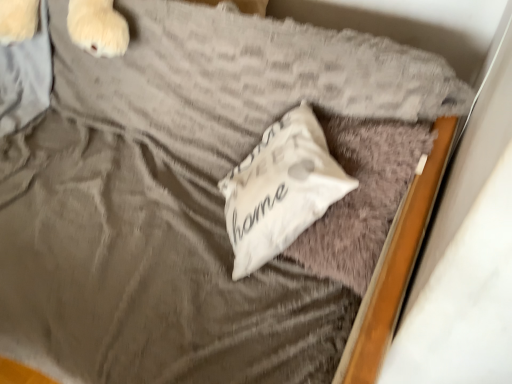
This screenshot has height=384, width=512. What do you see at coordinates (280, 189) in the screenshot? I see `white soft pillow at center, arranged as the 2th pillow when viewed from the right` at bounding box center [280, 189].

At what (x,y) coordinates should I click in order to perform the action: click on white soft pillow at center, arranged as the 2th pillow when viewed from the right. Please return your answer as a coordinate pair (x, y). Looking at the image, I should click on (280, 189).

In order to click on white soft pillow at center, placed as the 1th pillow when sorted from right to left in this screenshot , I will do `click(361, 195)`.

This screenshot has width=512, height=384. Describe the element at coordinates (361, 195) in the screenshot. I see `white soft pillow at center, placed as the 1th pillow when sorted from right to left` at that location.

Locate an element on the screen. This screenshot has width=512, height=384. white soft pillow at center, arranged as the 1th pillow when viewed from the left is located at coordinates (280, 189).

Does white soft pillow at center, arranged as the 1th pillow when viewed from the left, appear on the left side of white soft pillow at center, placed as the 1th pillow when sorted from right to left?

Indeed, white soft pillow at center, arranged as the 1th pillow when viewed from the left, is positioned on the left side of white soft pillow at center, placed as the 1th pillow when sorted from right to left.

Is white soft pillow at center, arranged as the 1th pillow when viewed from the left, further to camera compared to white soft pillow at center, placed as the 1th pillow when sorted from right to left?

Yes, white soft pillow at center, arranged as the 1th pillow when viewed from the left, is behind white soft pillow at center, placed as the 1th pillow when sorted from right to left.

Is point (341, 180) positioned after point (386, 235)?

Yes, it is behind point (386, 235).

From the image's perspective, relative to white soft pillow at center, placed as the 1th pillow when sorted from right to left, is white soft pillow at center, arranged as the 2th pillow when viewed from the right, above or below?

Clearly, from the image's perspective, white soft pillow at center, arranged as the 2th pillow when viewed from the right, is above white soft pillow at center, placed as the 1th pillow when sorted from right to left.

From the picture: From a real-world perspective, does white soft pillow at center, arranged as the 2th pillow when viewed from the right, stand above white soft pillow at center, which is counted as the second pillow, starting from the left?

Indeed, from a real-world perspective, white soft pillow at center, arranged as the 2th pillow when viewed from the right, stands above white soft pillow at center, which is counted as the second pillow, starting from the left.

Does white soft pillow at center, arranged as the 1th pillow when viewed from the left, have a greater width compared to white soft pillow at center, which is counted as the second pillow, starting from the left?

Incorrect, the width of white soft pillow at center, arranged as the 1th pillow when viewed from the left, does not surpass that of white soft pillow at center, which is counted as the second pillow, starting from the left.

Is white soft pillow at center, arranged as the 2th pillow when viewed from the right, shorter than white soft pillow at center, placed as the 1th pillow when sorted from right to left?

Correct, white soft pillow at center, arranged as the 2th pillow when viewed from the right, is not as tall as white soft pillow at center, placed as the 1th pillow when sorted from right to left.

Does white soft pillow at center, arranged as the 1th pillow when viewed from the left, have a larger size compared to white soft pillow at center, placed as the 1th pillow when sorted from right to left?

No, white soft pillow at center, arranged as the 1th pillow when viewed from the left, is not bigger than white soft pillow at center, placed as the 1th pillow when sorted from right to left.

Is white soft pillow at center, placed as the 1th pillow when sorted from right to left, a part of white soft pillow at center, arranged as the 1th pillow when viewed from the left?

Yes, white soft pillow at center, placed as the 1th pillow when sorted from right to left, is a part of white soft pillow at center, arranged as the 1th pillow when viewed from the left.

Is white soft pillow at center, arranged as the 2th pillow when viewed from the right, not near white soft pillow at center, placed as the 1th pillow when sorted from right to left?

white soft pillow at center, arranged as the 2th pillow when viewed from the right, is actually quite close to white soft pillow at center, placed as the 1th pillow when sorted from right to left.

Is white soft pillow at center, arranged as the 1th pillow when viewed from the left, turned away from white soft pillow at center, placed as the 1th pillow when sorted from right to left?

Yes, white soft pillow at center, placed as the 1th pillow when sorted from right to left, is at the back of white soft pillow at center, arranged as the 1th pillow when viewed from the left.

What are the coordinates of `pillow that is behind the white soft pillow at center, placed as the 1th pillow when sorted from right to left` in the screenshot? It's located at (280, 189).

Can you confirm if white soft pillow at center, placed as the 1th pillow when sorted from right to left, is positioned to the right of white soft pillow at center, arranged as the 2th pillow when viewed from the right?

Yes, white soft pillow at center, placed as the 1th pillow when sorted from right to left, is to the right of white soft pillow at center, arranged as the 2th pillow when viewed from the right.

In the image, is white soft pillow at center, placed as the 1th pillow when sorted from right to left, positioned in front of or behind white soft pillow at center, arranged as the 2th pillow when viewed from the right?

white soft pillow at center, placed as the 1th pillow when sorted from right to left, is positioned closer to the viewer than white soft pillow at center, arranged as the 2th pillow when viewed from the right.

Between point (354, 129) and point (265, 147), which one is positioned behind?

The point (265, 147) is farther from the camera.

From the image's perspective, is white soft pillow at center, which is counted as the second pillow, starting from the left, below white soft pillow at center, arranged as the 2th pillow when viewed from the right?

Yes, from the image's perspective, white soft pillow at center, which is counted as the second pillow, starting from the left, is beneath white soft pillow at center, arranged as the 2th pillow when viewed from the right.

From a real-world perspective, relative to white soft pillow at center, arranged as the 1th pillow when viewed from the left, is white soft pillow at center, placed as the 1th pillow when sorted from right to left, vertically above or below?

white soft pillow at center, placed as the 1th pillow when sorted from right to left, is below white soft pillow at center, arranged as the 1th pillow when viewed from the left.

Between white soft pillow at center, placed as the 1th pillow when sorted from right to left, and white soft pillow at center, arranged as the 2th pillow when viewed from the right, which one has smaller width?

With smaller width is white soft pillow at center, arranged as the 2th pillow when viewed from the right.

Does white soft pillow at center, which is counted as the second pillow, starting from the left, have a lesser height compared to white soft pillow at center, arranged as the 1th pillow when viewed from the left?

No, white soft pillow at center, which is counted as the second pillow, starting from the left, is not shorter than white soft pillow at center, arranged as the 1th pillow when viewed from the left.

Considering the sizes of objects white soft pillow at center, which is counted as the second pillow, starting from the left, and white soft pillow at center, arranged as the 1th pillow when viewed from the left, in the image provided, who is smaller, white soft pillow at center, which is counted as the second pillow, starting from the left, or white soft pillow at center, arranged as the 1th pillow when viewed from the left,?

white soft pillow at center, arranged as the 1th pillow when viewed from the left.

Is white soft pillow at center, placed as the 1th pillow when sorted from right to left, not inside white soft pillow at center, arranged as the 1th pillow when viewed from the left?

Actually, white soft pillow at center, placed as the 1th pillow when sorted from right to left, is at least partially inside white soft pillow at center, arranged as the 1th pillow when viewed from the left.

In the scene shown: Is white soft pillow at center, which is counted as the second pillow, starting from the left, with white soft pillow at center, arranged as the 1th pillow when viewed from the left?

No.

Is white soft pillow at center, which is counted as the second pillow, starting from the left, looking in the opposite direction of white soft pillow at center, arranged as the 1th pillow when viewed from the left?

Correct, white soft pillow at center, which is counted as the second pillow, starting from the left, is looking away from white soft pillow at center, arranged as the 1th pillow when viewed from the left.

How distant is white soft pillow at center, which is counted as the second pillow, starting from the left, from white soft pillow at center, arranged as the 2th pillow when viewed from the right?

white soft pillow at center, which is counted as the second pillow, starting from the left, is 3.95 inches from white soft pillow at center, arranged as the 2th pillow when viewed from the right.

Locate an element on the screen. This screenshot has height=384, width=512. pillow that is above the white soft pillow at center, which is counted as the second pillow, starting from the left (from a real-world perspective) is located at coordinates coord(280,189).

Where is `pillow behind the white soft pillow at center, which is counted as the second pillow, starting from the left`? This screenshot has height=384, width=512. pillow behind the white soft pillow at center, which is counted as the second pillow, starting from the left is located at coordinates (280, 189).

Identify the location of pillow above the white soft pillow at center, which is counted as the second pillow, starting from the left (from the image's perspective). pos(280,189).